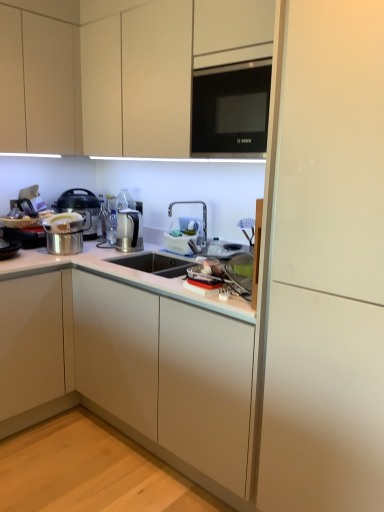
Locate an element on the screen. Image resolution: width=384 pixels, height=512 pixels. vacant area to the left of satin silver coffee machine at center is located at coordinates (100, 250).